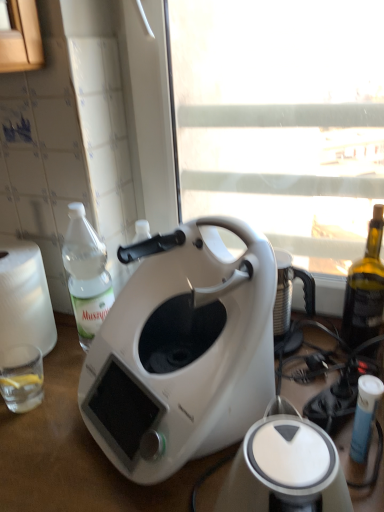
From the picture: Measure the distance between point (197, 502) and camera.

Point (197, 502) and camera are 24.49 inches apart from each other.

What is the approximate width of white plastic window screen at center?

3.81 inches.

Identify the location of clear glass at lower left. This screenshot has height=512, width=384. (21, 378).

What do you see at coordinates (182, 351) in the screenshot? I see `white matte coffee maker at center` at bounding box center [182, 351].

Identify the location of white matte table at center. The image size is (384, 512). (75, 451).

This screenshot has height=512, width=384. Identify the location of bottle that appears above the white matte coffee maker at center (from a real-world perspective). (86, 275).

From the image's perspective, relative to clear plastic bottle at left, is white matte coffee maker at center above or below?

white matte coffee maker at center is situated lower than clear plastic bottle at left in the image.

Is clear plastic bottle at left surrounded by white matte coffee maker at center?

Definitely not — clear plastic bottle at left is not inside white matte coffee maker at center.

From a real-world perspective, is white matte coffee maker at center on top of clear plastic bottle at left?

No, from a real-world perspective, white matte coffee maker at center is not over clear plastic bottle at left

Is white plastic window screen at center completely or partially inside white plastic toaster at center?

No, white plastic window screen at center is located outside of white plastic toaster at center.

Is white plastic toaster at center in front of or behind white plastic window screen at center in the image?

white plastic toaster at center is in front of white plastic window screen at center.

Can you confirm if white plastic toaster at center is taller than white plastic window screen at center?

In fact, white plastic toaster at center may be shorter than white plastic window screen at center.

Can you confirm if white plastic window screen at center is taller than white matte table at center?

No.

From the picture: Is white plastic window screen at center smaller than white matte table at center?

Yes, white plastic window screen at center is smaller than white matte table at center.

Based on the photo, which object is thinner, white plastic window screen at center or white matte table at center?

white plastic window screen at center is thinner.

From a real-world perspective, between white matte table at center and clear plastic bottle at left, who is vertically lower?

In real-world perspective, white matte table at center is lower.

Which is correct: white matte table at center is inside clear plastic bottle at left, or outside of it?

white matte table at center is located beyond the bounds of clear plastic bottle at left.

Who is shorter, white matte table at center or clear plastic bottle at left?

With less height is clear plastic bottle at left.

Locate an element on the screen. The height and width of the screenshot is (512, 384). bottle on the right of white matte table at center is located at coordinates (86, 275).

From the image's perspective, is white matte table at center positioned above or below white plastic window screen at center?

From the image's perspective, white matte table at center appears below white plastic window screen at center.

Is white matte table at center turned away from white plastic window screen at center?

white matte table at center is not turned away from white plastic window screen at center.

You are a GUI agent. You are given a task and a screenshot of the screen. Output one action in this format:
    pyautogui.click(x=<x>, y=<y>)
    Task: Click on the window screen above the white matte table at center (from a real-world perspective)
    Image resolution: width=384 pixels, height=512 pixels.
    Given the screenshot: What is the action you would take?
    pyautogui.click(x=282, y=116)

Choose the correct answer: Is white matte table at center inside white plastic window screen at center or outside it?

white matte table at center is located beyond the bounds of white plastic window screen at center.

From the image's perspective, between white matte coffee maker at center and white plastic toaster at center, which one is located above?

white matte coffee maker at center.

Which object is wider, white matte coffee maker at center or white plastic toaster at center?

white matte coffee maker at center is wider.

Which is correct: white matte coffee maker at center is inside white plastic toaster at center, or outside of it?

white matte coffee maker at center lies outside white plastic toaster at center.

Is white matte coffee maker at center positioned with its back to white plastic toaster at center?

No, white plastic toaster at center is not at the back of white matte coffee maker at center.

Considering the sizes of clear glass at lower left and clear plastic bottle at left in the image, is clear glass at lower left wider or thinner than clear plastic bottle at left?

Clearly, clear glass at lower left has less width compared to clear plastic bottle at left.

Would you say clear glass at lower left is inside or outside clear plastic bottle at left?

The correct answer is: outside.

How many degrees apart are the facing directions of clear glass at lower left and clear plastic bottle at left?

They differ by 0.395 degrees in their facing directions.

Does point (17, 403) come closer to viewer compared to point (91, 289)?

Yes, point (17, 403) is closer to viewer.

Where is `coffee maker below the clear plastic bottle at left (from the image's perspective)`? coffee maker below the clear plastic bottle at left (from the image's perspective) is located at coordinates (182, 351).

Identify the location of toaster in front of the white plastic window screen at center. The height and width of the screenshot is (512, 384). (285, 468).

From the image, which object appears to be farther from clear glass at lower left, white matte table at center or white matte coffee maker at center?

white matte coffee maker at center lies further to clear glass at lower left than the other object.

Based on their spatial positions, is white matte coffee maker at center or clear plastic bottle at left further from white matte table at center?

clear plastic bottle at left lies further to white matte table at center than the other object.

Considering their positions, is white matte coffee maker at center positioned further to clear plastic bottle at left than clear glass at lower left?

white matte coffee maker at center lies further to clear plastic bottle at left than the other object.

Considering their positions, is white matte coffee maker at center positioned closer to clear plastic bottle at left than white matte table at center?

The object closer to clear plastic bottle at left is white matte coffee maker at center.

Considering their positions, is white plastic toaster at center positioned closer to white matte table at center than white matte coffee maker at center?

white matte coffee maker at center is closer to white matte table at center.

From the image, which object appears to be farther from white plastic toaster at center, clear plastic bottle at left or clear glass at lower left?

clear glass at lower left is positioned further to the anchor white plastic toaster at center.

Considering their positions, is white plastic toaster at center positioned further to clear glass at lower left than white matte coffee maker at center?

white plastic toaster at center is positioned further to the anchor clear glass at lower left.

Considering their positions, is clear glass at lower left positioned closer to white plastic window screen at center than clear plastic bottle at left?

Based on the image, clear plastic bottle at left appears to be nearer to white plastic window screen at center.

In order to click on coffee maker between white plastic toaster at center and clear plastic bottle at left along the z-axis in this screenshot , I will do `click(182, 351)`.

Find the location of a particular element. coffee cup positioned between white matte coffee maker at center and clear plastic bottle at left from near to far is located at coordinates (21, 378).

At what (x,y) coordinates should I click in order to perform the action: click on coffee maker between white plastic window screen at center and white plastic toaster at center vertically. Please return your answer as a coordinate pair (x, y). This screenshot has height=512, width=384. Looking at the image, I should click on (182, 351).

Locate an element on the screen. coffee maker located between white plastic toaster at center and clear glass at lower left in the depth direction is located at coordinates [x=182, y=351].